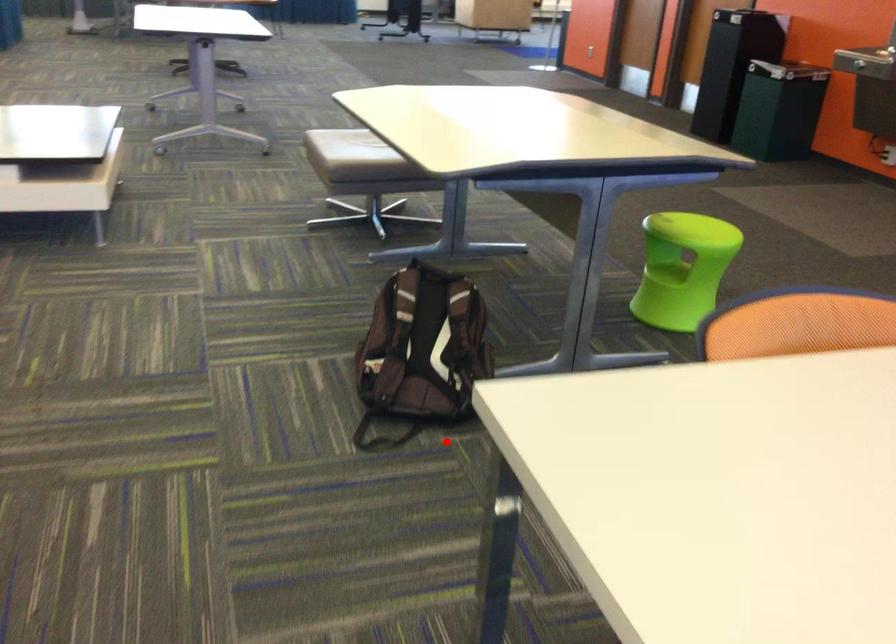
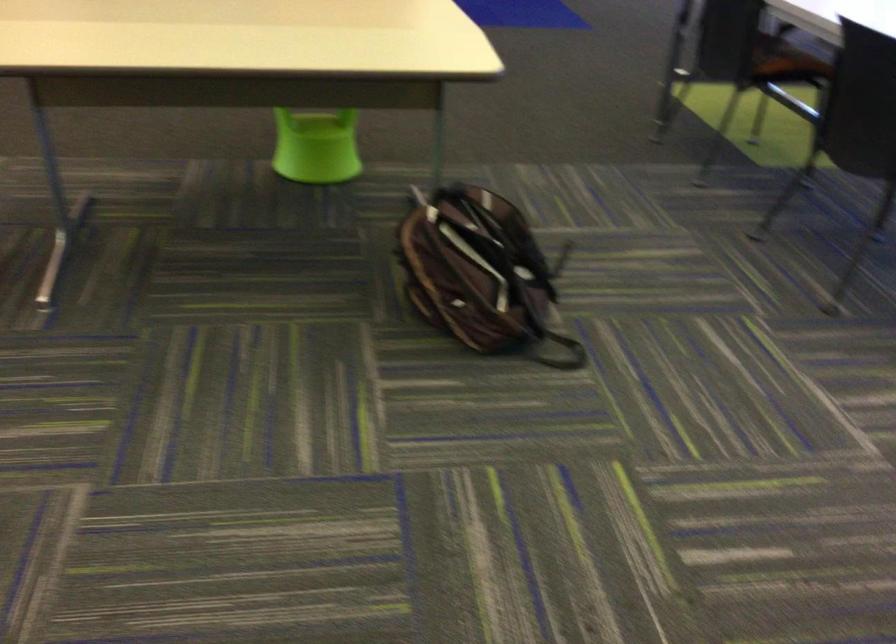
The point at the highlighted location is marked in the first image. Where is the corresponding point in the second image?

(552, 322)